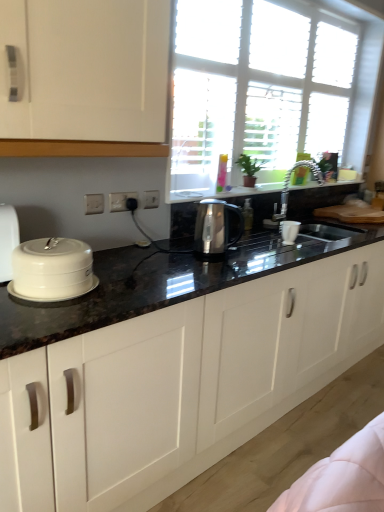
Locate an element on the screen. free region under satin metallic kettle at center (from a real-world perspective) is located at coordinates (232, 254).